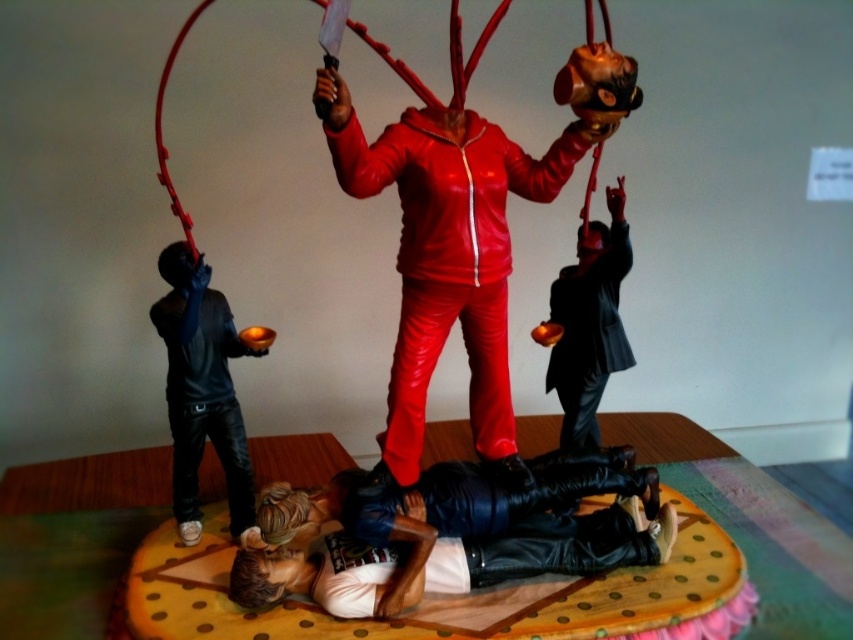
Question: Does leather jacket at lower center have a smaller size compared to matte black suit at center?

Choices:
 (A) no
 (B) yes

Answer: (A)

Question: Considering the relative positions of leather jacket at lower center and black leather jacket at left in the image provided, where is leather jacket at lower center located with respect to black leather jacket at left?

Choices:
 (A) below
 (B) above

Answer: (A)

Question: Which point is closer to the camera taking this photo?

Choices:
 (A) (242, 435)
 (B) (509, 262)
 (C) (251, 554)

Answer: (C)

Question: Among these points, which one is farthest from the camera?

Choices:
 (A) (537, 557)
 (B) (225, 365)
 (C) (616, 289)

Answer: (C)

Question: Is leather jacket at lower center above black leather jacket at left?

Choices:
 (A) no
 (B) yes

Answer: (A)

Question: Which object is positioned farthest from the matte black suit at center?

Choices:
 (A) shiny red suit at center
 (B) leather jacket at lower center
 (C) black leather jacket at left

Answer: (C)